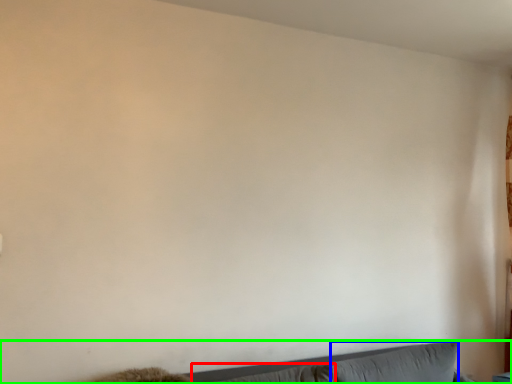
Question: Considering the real-world distances, which object is farthest from pillow (highlighted by a red box)? pillow (highlighted by a blue box) or couch (highlighted by a green box)?

Choices:
 (A) pillow
 (B) couch

Answer: (A)